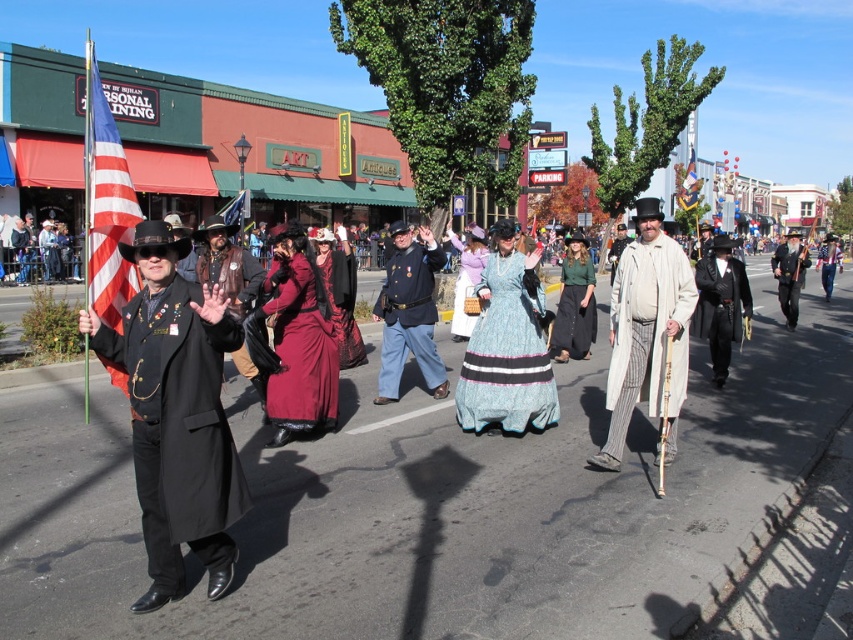
From the picture: You are standing in the middle of the parade street. You want to take a photo of the american flag at left. Where should you look to capture it in your camera?

The american flag at left is located at the 2D coordinates point 0.320 on the x axis and 0.125 on the y axis, so you should aim your camera towards that position to capture it.

You are standing at the starting point of the parade route and want to reach the end of the parade route as quickly as possible. There are two points marked on the route map at coordinates point (572, 273) and point (694, 163). Which point should you head towards first to reach the end faster?

You should head towards point (572, 273) first because it is in front of point (694, 163), meaning it is closer to the starting point and thus the faster route to the end.

You are a photographer at the parade. You want to take a photo that includes both the american flag at left and the teal satin dress at center. Which object should you focus on first to ensure both are in frame?

The american flag at left is bigger than the teal satin dress at center, so you should focus on the american flag at left first to ensure both are in frame.